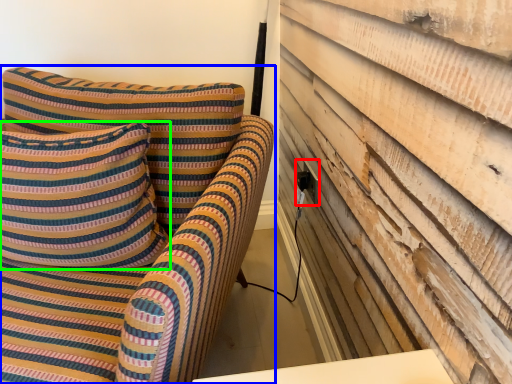
Question: Which object is positioned farthest from electric outlet (highlighted by a red box)? Select from furniture (highlighted by a blue box) and pillow (highlighted by a green box).

Choices:
 (A) furniture
 (B) pillow

Answer: (B)